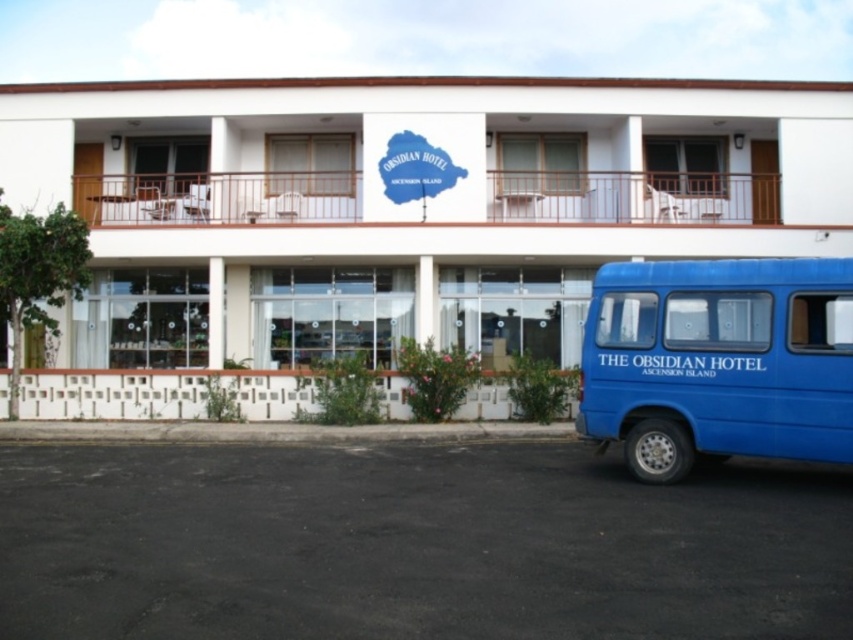
Is white matte building at center to the right of blue matte van at lower right from the viewer's perspective?

No, white matte building at center is not to the right of blue matte van at lower right.

Is white matte building at center in front of blue matte van at lower right?

No, it is not.

Does point (496, 176) come behind point (811, 358)?

Yes, it is behind point (811, 358).

Where is `white matte building at center`? white matte building at center is located at coordinates [407, 204].